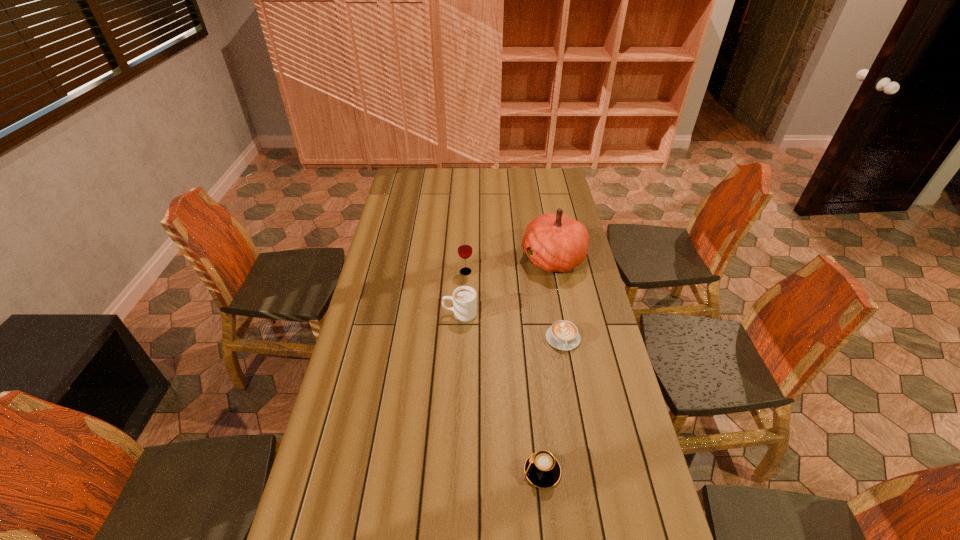
Find the location of a particular element. The height and width of the screenshot is (540, 960). free location that satisfies the following two spatial constraints: 1. on the side with the handle of the third nearest object; 2. on the back side of the nearest cappuccino is located at coordinates (452, 471).

Locate an element on the screen. This screenshot has width=960, height=540. blank space that satisfies the following two spatial constraints: 1. on the front-facing side of the pumpkin; 2. on the side of the second nearest object with the handle is located at coordinates (569, 339).

Where is `vacant space that satisfies the following two spatial constraints: 1. on the back side of the nearest cappuccino; 2. on the side with the handle of the tallest cappuccino`? vacant space that satisfies the following two spatial constraints: 1. on the back side of the nearest cappuccino; 2. on the side with the handle of the tallest cappuccino is located at coordinates (525, 314).

Identify the location of vacant area in the image that satisfies the following two spatial constraints: 1. on the side with the handle of the nearest object; 2. on the left side of the third shortest object. The width and height of the screenshot is (960, 540). (452, 471).